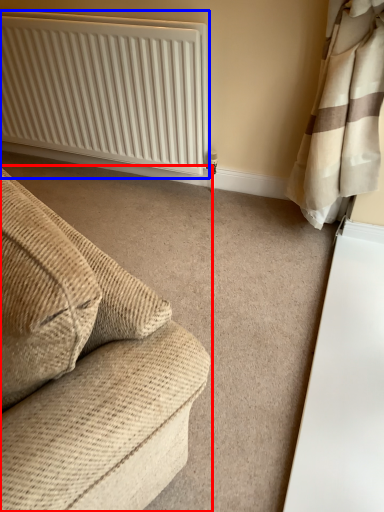
Question: Which object appears farthest to the camera in this image, studio couch (highlighted by a red box) or radiator (highlighted by a blue box)?

Choices:
 (A) studio couch
 (B) radiator

Answer: (B)